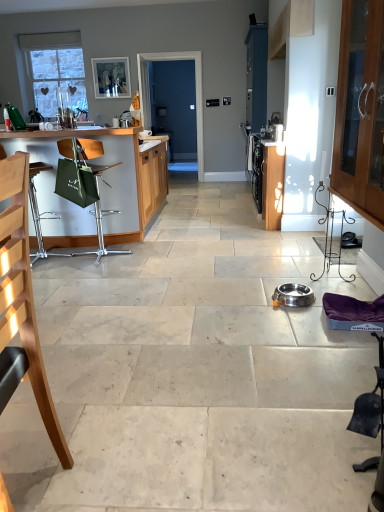
You are a GUI agent. You are given a task and a screenshot of the screen. Output one action in this format:
    pyautogui.click(x=<x>, y=<y>)
    Task: Click on the vacant space that is to the left of stainless steel bowl at center
    
    Given the screenshot: What is the action you would take?
    pyautogui.click(x=253, y=302)